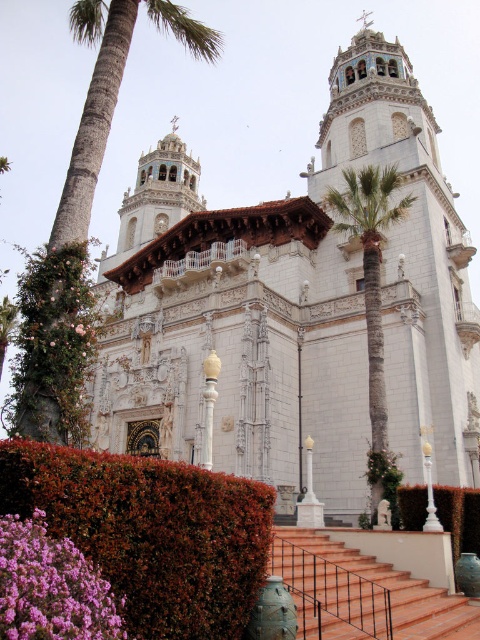
You are standing in front of the grand building and want to take a photo that includes both the white stone church at center and the green leafy palm tree at center. Which one should you zoom in on to ensure both fit in the frame?

The white stone church at center is wider than the green leafy palm tree at center, so you should zoom out slightly to ensure both fit in the frame.

You are standing in front of the grand Spanish Colonial Revival building and want to walk to the green leafy hedge at lower left. Based on the distance provided, can you estimate how many average paces it would take to reach the hedge?

The green leafy hedge at lower left is 28.06 meters away from the viewer. Assuming an average pace is about 0.76 meters, it would take approximately 37 paces to reach the hedge.

You are a landscape architect planning to install a new pathway between the green leafy hedge at lower left and the terracotta tile stairs at center. The pathway requires a minimum of 15 meters of space. Based on the image, will the available space be sufficient?

The distance between the green leafy hedge at lower left and the terracotta tile stairs at center is 14.81 meters, which is less than the required 15 meters. Therefore, the available space is insufficient for the pathway.